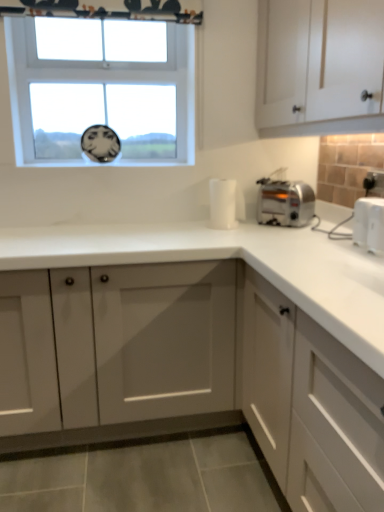
Question: Is white plastic electric outlet at upper right located outside clear glass window at upper center?

Choices:
 (A) yes
 (B) no

Answer: (A)

Question: Can you confirm if white plastic electric outlet at upper right is thinner than clear glass window at upper center?

Choices:
 (A) no
 (B) yes

Answer: (A)

Question: Considering the relative positions of white plastic electric outlet at upper right and clear glass window at upper center in the image provided, is white plastic electric outlet at upper right behind clear glass window at upper center?

Choices:
 (A) yes
 (B) no

Answer: (B)

Question: From the image's perspective, would you say white plastic electric outlet at upper right is positioned over clear glass window at upper center?

Choices:
 (A) yes
 (B) no

Answer: (B)

Question: Is clear glass window at upper center inside white plastic electric outlet at upper right?

Choices:
 (A) yes
 (B) no

Answer: (B)

Question: Is white plastic electric outlet at upper right far from clear glass window at upper center?

Choices:
 (A) yes
 (B) no

Answer: (A)

Question: Does satin silver toaster at right have a lesser height compared to white matte cabinet at upper right, marked as the 1th cabinetry in a top-to-bottom arrangement?

Choices:
 (A) yes
 (B) no

Answer: (A)

Question: From the image's perspective, is satin silver toaster at right below white matte cabinet at upper right, the 3th cabinetry in the bottom-to-top sequence?

Choices:
 (A) no
 (B) yes

Answer: (B)

Question: Is satin silver toaster at right smaller than white matte cabinet at upper right, marked as the 1th cabinetry in a top-to-bottom arrangement?

Choices:
 (A) yes
 (B) no

Answer: (A)

Question: Can you confirm if satin silver toaster at right is thinner than white matte cabinet at upper right, marked as the 1th cabinetry in a top-to-bottom arrangement?

Choices:
 (A) no
 (B) yes

Answer: (B)

Question: From the image's perspective, is satin silver toaster at right on top of white matte cabinet at upper right, marked as the 1th cabinetry in a top-to-bottom arrangement?

Choices:
 (A) yes
 (B) no

Answer: (B)

Question: From a real-world perspective, is satin silver toaster at right positioned over white matte cabinet at upper right, marked as the 1th cabinetry in a top-to-bottom arrangement, based on gravity?

Choices:
 (A) no
 (B) yes

Answer: (A)

Question: From a real-world perspective, does white matte cabinet at lower right, the third cabinetry when ordered from top to bottom, stand above white plastic toaster at right?

Choices:
 (A) yes
 (B) no

Answer: (B)